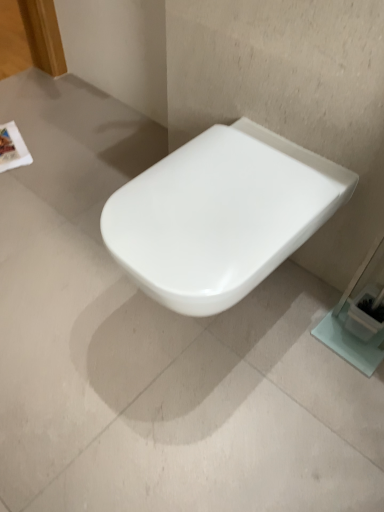
The width and height of the screenshot is (384, 512). Identify the location of free space below white glossy toilet at center (from a real-world perspective). (212, 320).